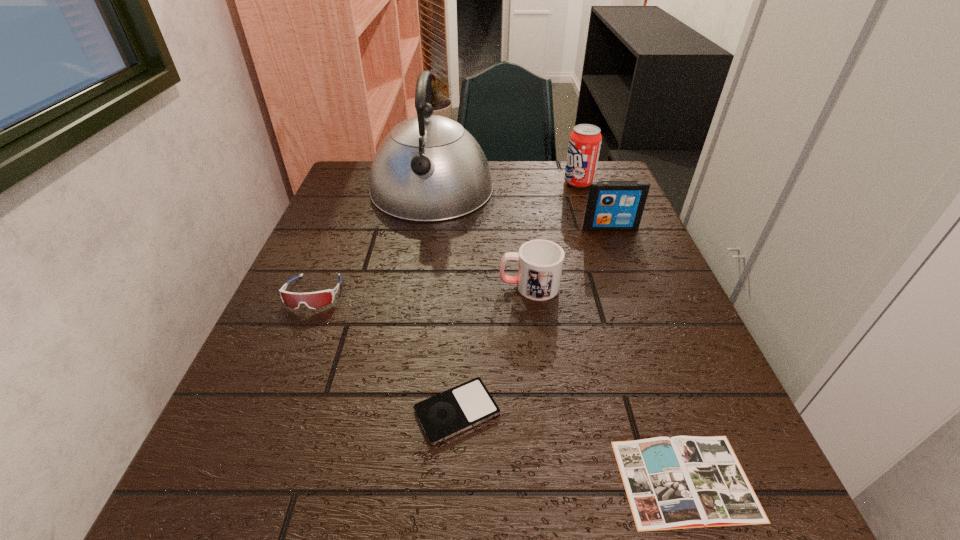
The width and height of the screenshot is (960, 540). Identify the location of vacant space located 0.210m from the spout of the kettle. (417, 284).

Identify the location of vacant space located on the surface of the soda can. The height and width of the screenshot is (540, 960). (445, 183).

Where is `vacant space situated 0.260m on the surface of the soda can`? The height and width of the screenshot is (540, 960). vacant space situated 0.260m on the surface of the soda can is located at coordinates (470, 183).

This screenshot has width=960, height=540. I want to click on vacant area situated 0.340m on the surface of the soda can, so click(x=443, y=183).

You are a GUI agent. You are given a task and a screenshot of the screen. Output one action in this format:
    pyautogui.click(x=<x>, y=<y>)
    Task: Click on the vacant region located 0.200m on the front screen of the third tallest object
    
    Given the screenshot: What is the action you would take?
    pyautogui.click(x=633, y=288)

The image size is (960, 540). Identify the location of free spot located 0.270m on the side of the fourth tallest object with the handle. (368, 286).

In order to click on vacant space positioned 0.370m on the side of the fourth tallest object with the handle in this screenshot , I will do `click(320, 286)`.

At what (x,y) coordinates should I click in order to perform the action: click on blank space located on the side of the fourth tallest object with the handle. Please return your answer as a coordinate pair (x, y). The width and height of the screenshot is (960, 540). Looking at the image, I should click on (402, 286).

This screenshot has width=960, height=540. Identify the location of free spot located on the front-facing side of the goggles. (263, 415).

Where is `vacant space located 0.210m on the left of the nearer iPod`? The image size is (960, 540). vacant space located 0.210m on the left of the nearer iPod is located at coordinates (279, 411).